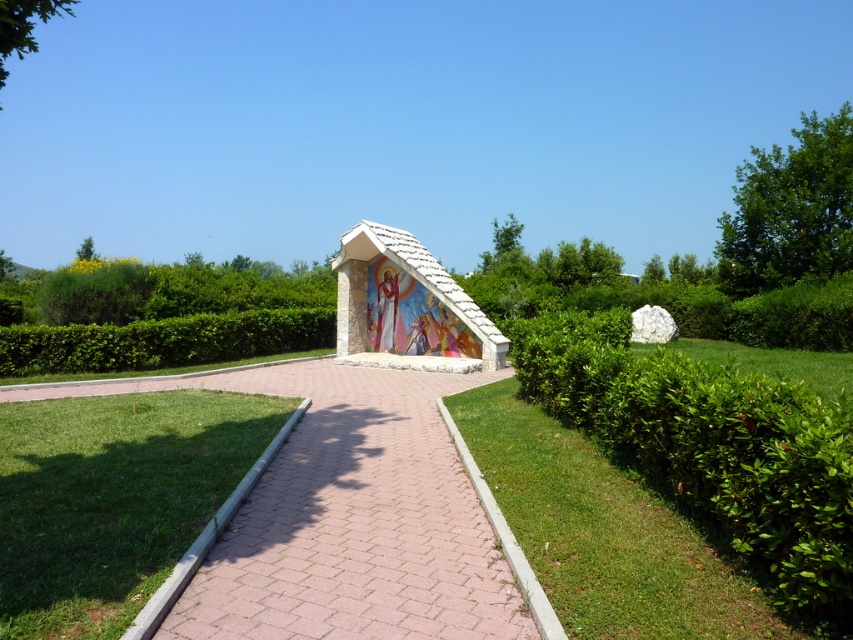
Question: Which object appears farthest from the camera in this image?

Choices:
 (A) green grass at lower left
 (B) green leafy hedge at center
 (C) white stone gazebo at center

Answer: (C)

Question: Which object appears farthest from the camera in this image?

Choices:
 (A) pink brick path at center
 (B) white stone gazebo at center
 (C) green grass at lower left
 (D) green leafy hedge at center

Answer: (B)

Question: Is white stone shrine at center thinner than green leafy hedge at center?

Choices:
 (A) yes
 (B) no

Answer: (B)

Question: Which of the following is the farthest from the observer?

Choices:
 (A) white stone gazebo at center
 (B) green leafy hedge at center
 (C) pink brick path at center

Answer: (A)

Question: Is white stone gazebo at center bigger than green leafy hedge at center?

Choices:
 (A) yes
 (B) no

Answer: (B)

Question: Can you confirm if green grass at lower left is positioned to the right of green leafy bush at right?

Choices:
 (A) no
 (B) yes

Answer: (A)